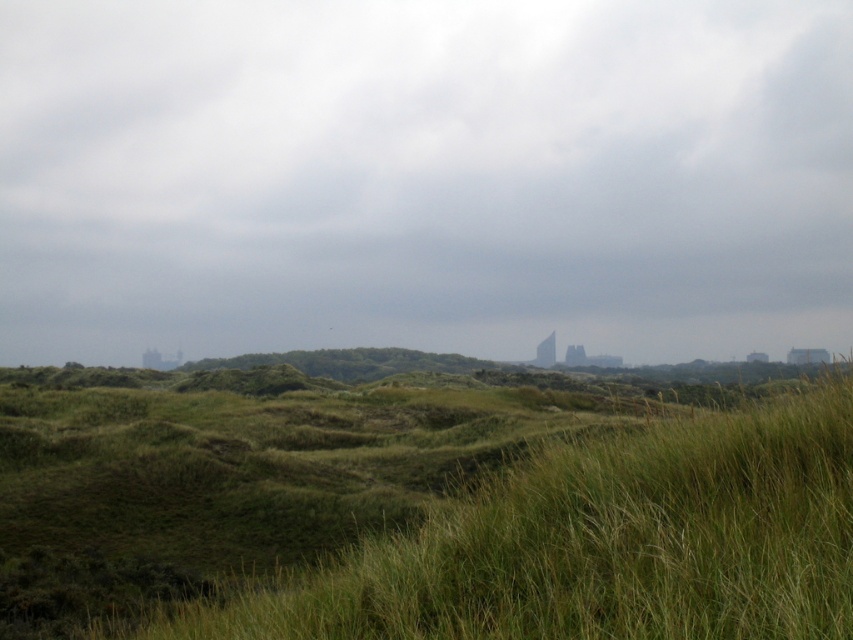
Question: Is the position of gray cloudy sky at upper center more distant than that of green grassy at center?

Choices:
 (A) yes
 (B) no

Answer: (A)

Question: Among these points, which one is farthest from the camera?

Choices:
 (A) (206, 570)
 (B) (252, 186)

Answer: (B)

Question: Does gray cloudy sky at upper center appear on the left side of green grassy at center?

Choices:
 (A) yes
 (B) no

Answer: (A)

Question: Can you confirm if gray cloudy sky at upper center is positioned to the left of green grassy at center?

Choices:
 (A) no
 (B) yes

Answer: (B)

Question: Which point is closer to the camera?

Choices:
 (A) gray cloudy sky at upper center
 (B) green grassy at center

Answer: (B)